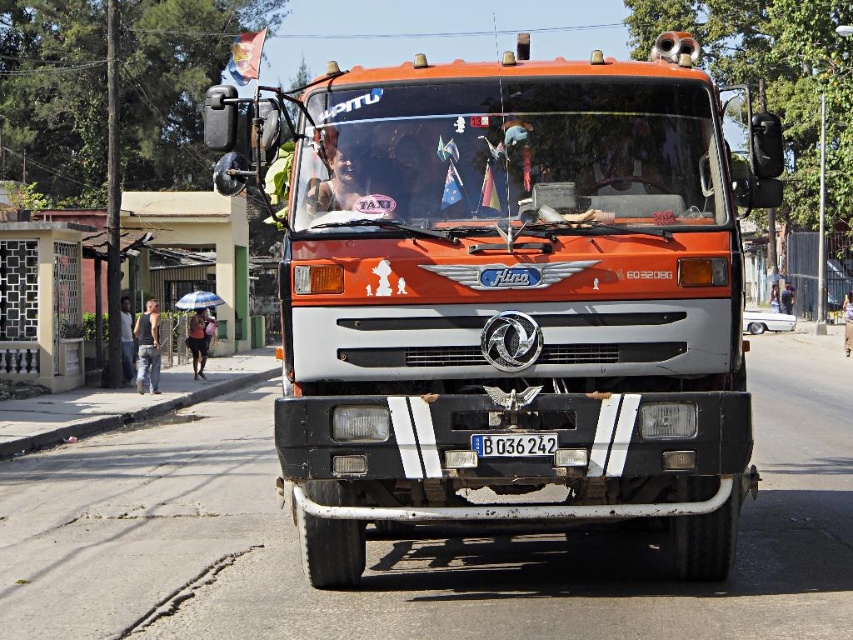
You are a photographer taking a closeup shot of the Hino truck. You need to ensure both the matte black face at center and the blue plastic license plate at center are in focus. Which object should you adjust your camera focus on first to account for their sizes?

The matte black face at center is wider than the blue plastic license plate at center, so you should focus on the matte black face at center first as it covers more area and requires precise focus to ensure both objects are sharp.

You are a photographer trying to capture the orange matte truck at center and the blue plastic license plate at center in a single frame. Given their size difference, which object will appear larger in the photo?

The orange matte truck at center will appear larger in the photo because it is much taller than the blue plastic license plate at center.